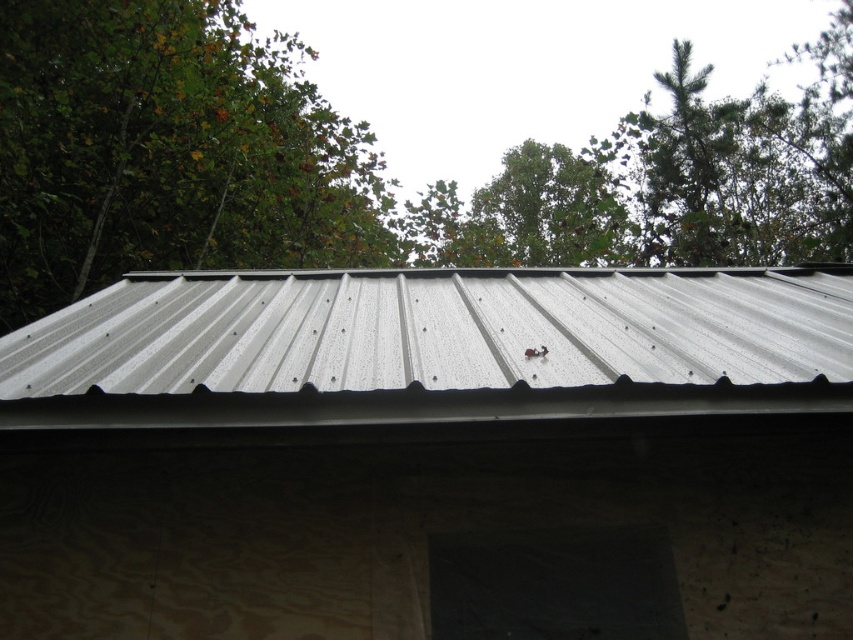
Is point (791, 131) farther from viewer compared to point (599, 388)?

Yes, it is behind point (599, 388).

Is green leafy tree at upper center further to camera compared to metallic gray roof at center?

Yes.

At what (x,y) coordinates should I click in order to perform the action: click on green leafy tree at upper center. Please return your answer as a coordinate pair (x, y). This screenshot has height=640, width=853. Looking at the image, I should click on (368, 163).

What do you see at coordinates (432, 348) in the screenshot? The width and height of the screenshot is (853, 640). I see `metallic gray roof at center` at bounding box center [432, 348].

The width and height of the screenshot is (853, 640). Identify the location of metallic gray roof at center. (432, 348).

Is green leafy tree at upper center below green leafy tree at upper left?

No.

Who is lower down, green leafy tree at upper center or green leafy tree at upper left?

Positioned lower is green leafy tree at upper left.

The height and width of the screenshot is (640, 853). I want to click on green leafy tree at upper center, so click(x=368, y=163).